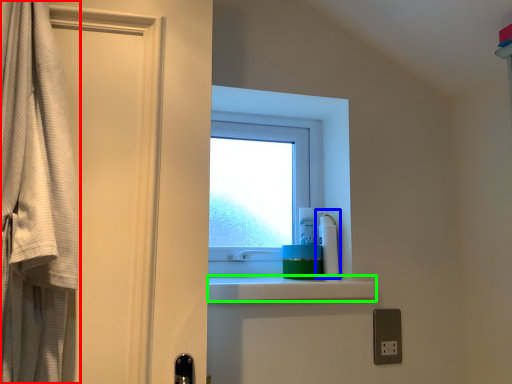
Question: Which is farther away from curtain (highlighted by a red box)? cleaning product (highlighted by a blue box) or balustrade (highlighted by a green box)?

Choices:
 (A) cleaning product
 (B) balustrade

Answer: (A)